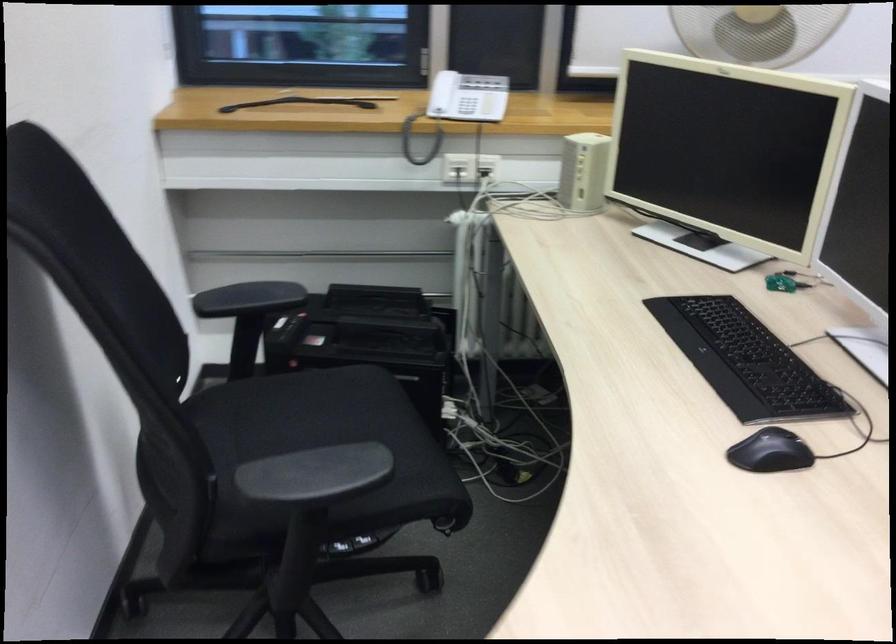
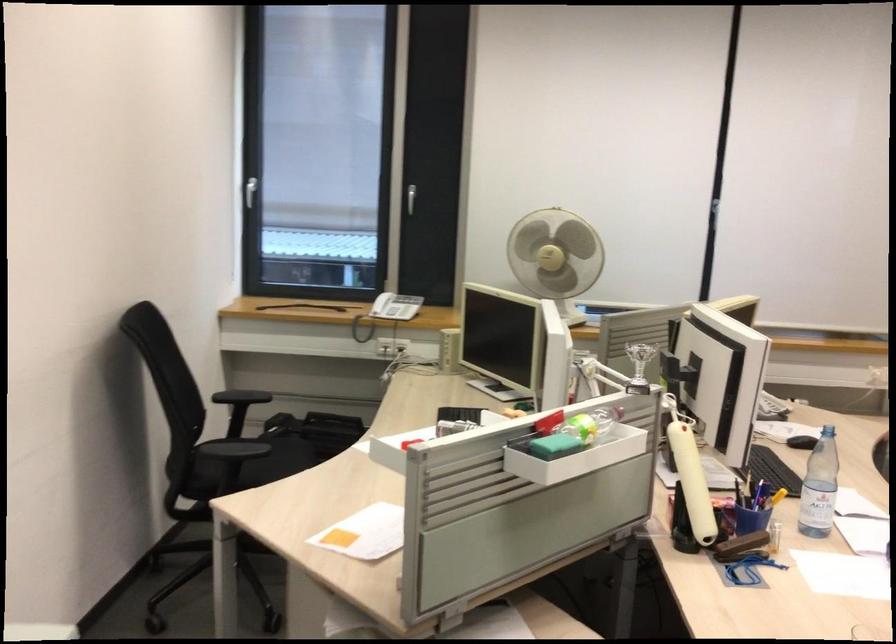
Find the pixel in the second image that matches the point at 459,111 in the first image.

(386, 312)